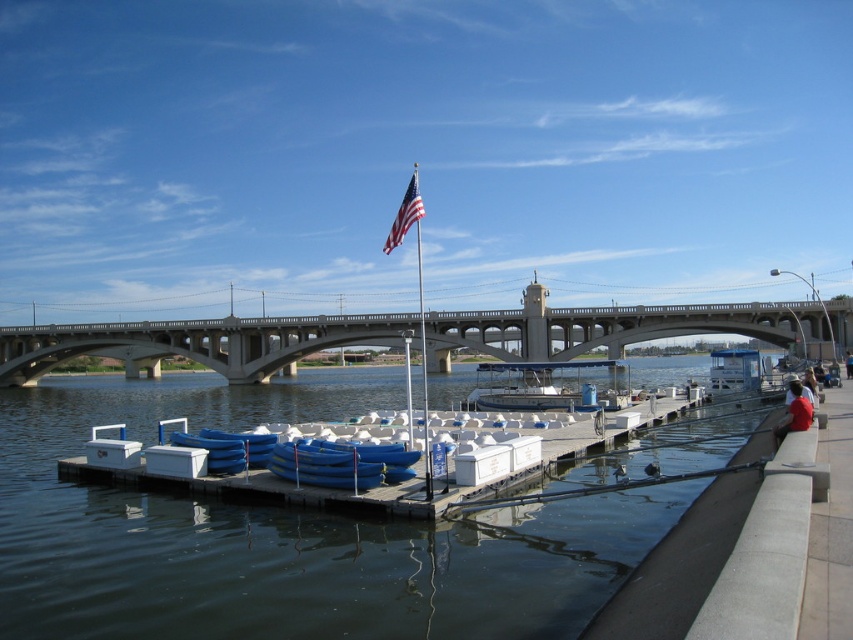
In the scene shown: You are standing on the dock and want to locate the clear water at dock center. According to the coordinates given, where exactly should you look?

The clear water at dock center is located at the coordinates point (x=283, y=536).